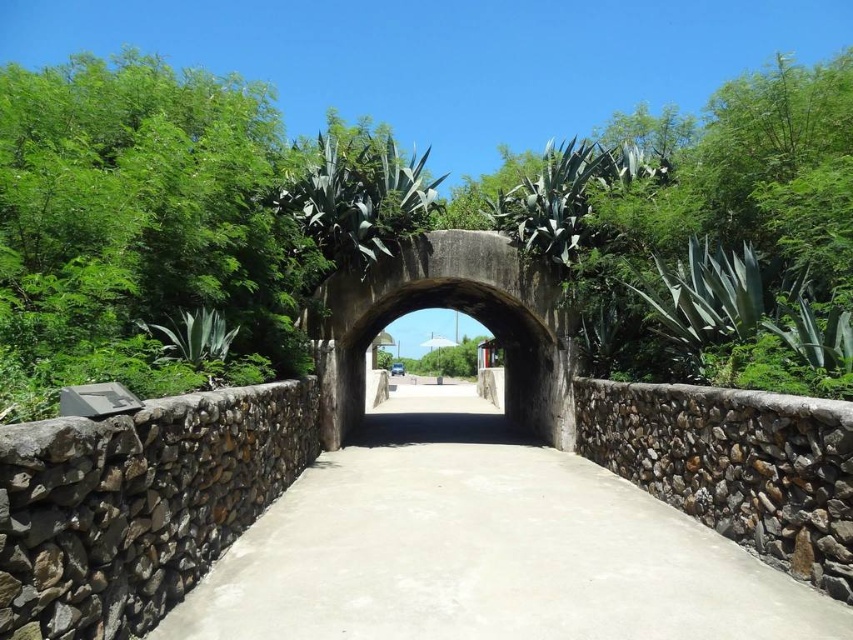
You are a landscape architect designing a garden. You want to place a bench along the smooth concrete path at center so that it is exactly halfway between the green leafy tree at center and the start of the path. If the path is 37.48 feet long, where should you place the bench?

The green leafy tree at center is 18.74 feet from the smooth concrete path at center. Since the path is 37.48 feet long, the halfway point between the tree and the start of the path would be at 9.37 feet from the start of the path. Therefore, the bench should be placed 9.37 feet from the start of the smooth concrete path at center.

You are standing at the starting point of the pathway and want to reach the end. There are two points marked on the path, point (215, 97) and point (364, 464). Which point should you pass first?

You should pass point (215, 97) first because it is in front of point (364, 464) along the pathway.